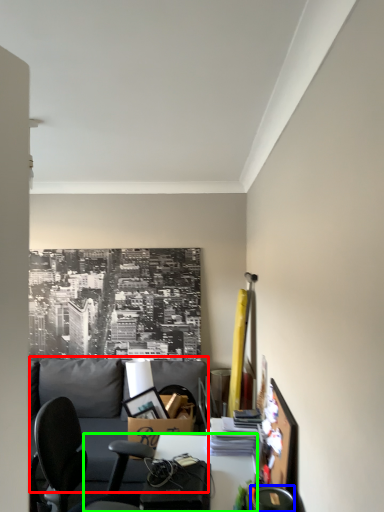
Question: Estimate the real-world distances between objects in this image. Which object is farther from couch (highlighted by a red box), chair (highlighted by a blue box) or desk (highlighted by a green box)?

Choices:
 (A) chair
 (B) desk

Answer: (A)